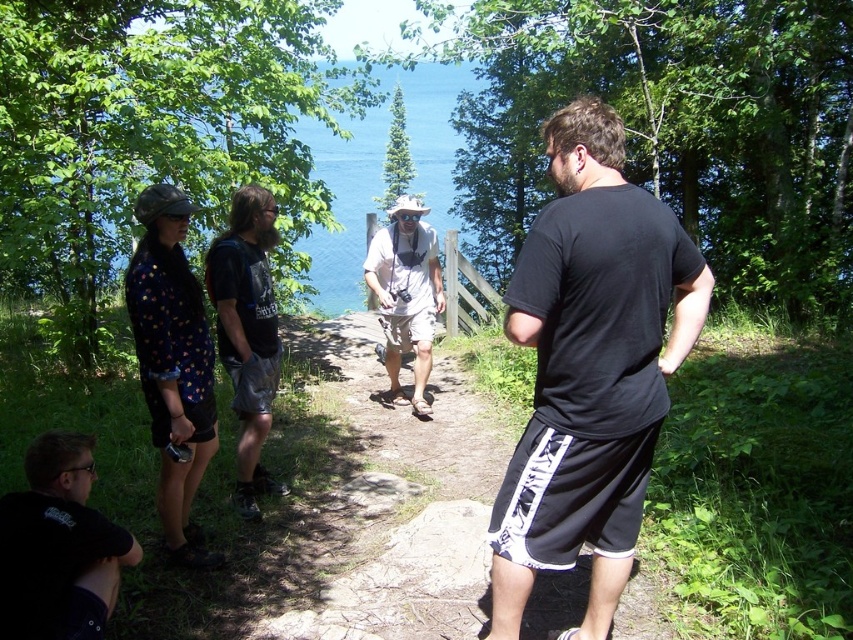
Is black cotton t-shirt at center shorter than white cotton shirt at center?

No.

Between black cotton t-shirt at center and white cotton shirt at center, which one has less height?

Standing shorter between the two is white cotton shirt at center.

The height and width of the screenshot is (640, 853). In order to click on black cotton t-shirt at center in this screenshot , I will do `click(589, 368)`.

The width and height of the screenshot is (853, 640). Identify the location of black cotton t-shirt at center. pyautogui.click(x=589, y=368).

Which is behind, point (614, 257) or point (381, 620)?

The point (381, 620) is more distant.

Which is in front, point (579, 451) or point (370, 576)?

Point (579, 451) is more forward.

Does point (514, 301) come behind point (418, 620)?

No, it is in front of (418, 620).

Where is `black cotton t-shirt at center`? black cotton t-shirt at center is located at coordinates (589, 368).

Does black fabric shorts at center appear under black matte t-shirt at lower left?

Indeed, black fabric shorts at center is positioned under black matte t-shirt at lower left.

Is black fabric shorts at center smaller than black matte t-shirt at lower left?

Indeed, black fabric shorts at center has a smaller size compared to black matte t-shirt at lower left.

Measure the distance between point (335, 632) and camera.

The distance of point (335, 632) from camera is 3.39 meters.

Locate an element on the screen. black fabric shorts at center is located at coordinates (404, 496).